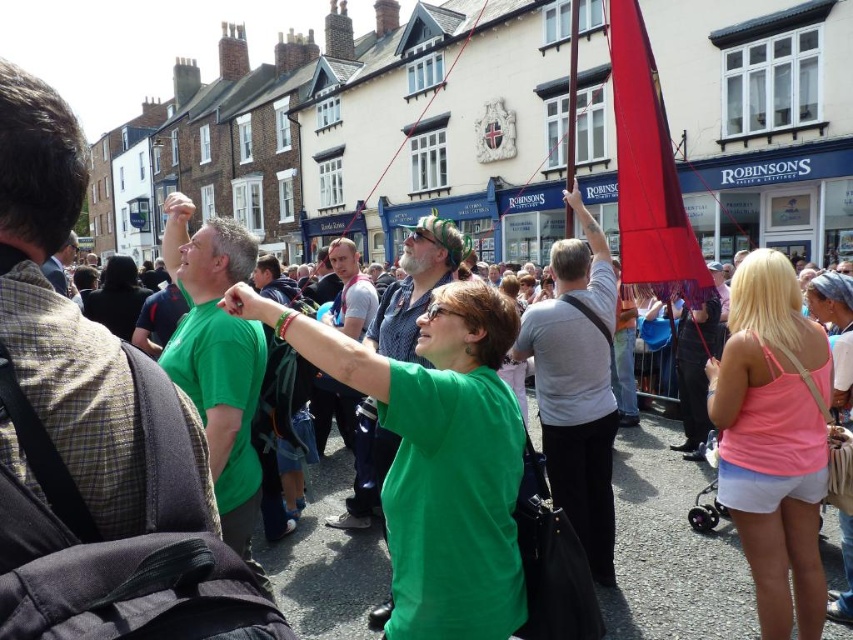
Between pink fabric tank top at center and silky red flag at upper right, which one is positioned higher?

silky red flag at upper right is higher up.

Who is positioned more to the left, pink fabric tank top at center or silky red flag at upper right?

From the viewer's perspective, silky red flag at upper right appears more on the left side.

The height and width of the screenshot is (640, 853). I want to click on pink fabric tank top at center, so click(773, 440).

Where is `pink fabric tank top at center`? This screenshot has width=853, height=640. pink fabric tank top at center is located at coordinates (773, 440).